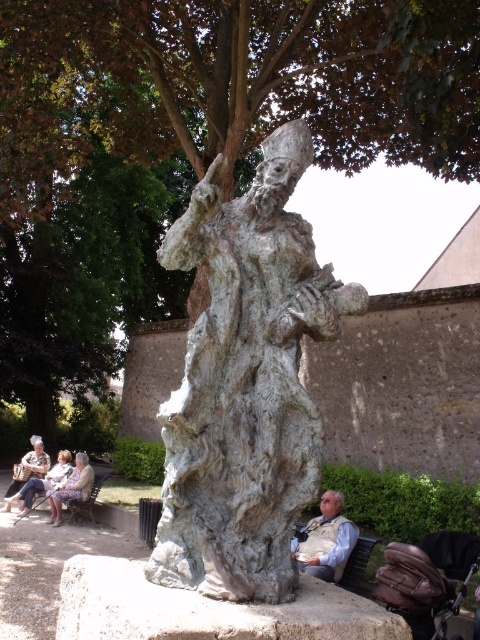
You are standing in the garden and want to take a photo of the bronze statue at center. To ensure the statue is in the center of your photo, where should you position yourself relative to the statue?

The bronze statue at center is located at point [245,384], so you should position yourself directly in front of the bronze statue at center to ensure it is centered in your photo.

You are a visitor standing at the base of the gray stone statue at center. You want to reach the white textured fabric at lower left without walking around the statue. Can you directly walk towards it in a straight line?

The gray stone statue at center is 6.34 meters away from the white textured fabric at lower left. Since you are at the base of the gray stone statue at center, you can walk straight towards the white textured fabric at lower left in a straight line, as there is no mention of obstacles between them.

You are a visitor in the garden and want to take a photo of the bronze statue at center without the white textured fabric at lower left appearing in the shot. How should you position yourself?

Position yourself so that the bronze statue at center is framed in a way that the white textured fabric at lower left is out of the camera view. Since the bronze statue at center is above the white textured fabric at lower left, moving closer to the statue or angling the camera upward will help exclude the fabric from the photo.